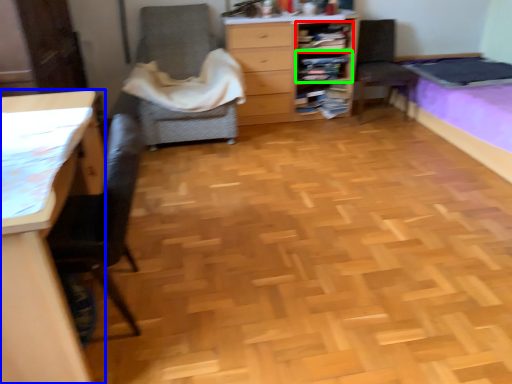
Question: Based on their relative distances, which object is nearer to shelf (highlighted by a red box)? Choose from desk (highlighted by a blue box) and shelf (highlighted by a green box).

Choices:
 (A) desk
 (B) shelf

Answer: (B)